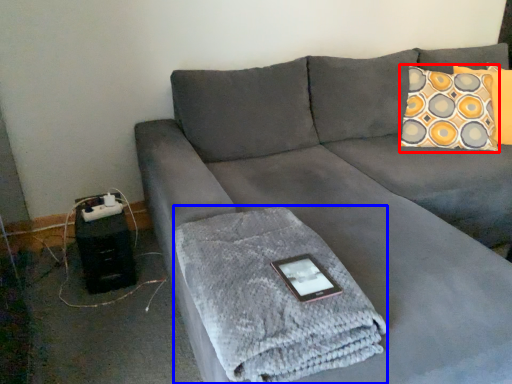
Question: Which object appears farthest to the camera in this image, throw pillow (highlighted by a red box) or bath towel (highlighted by a blue box)?

Choices:
 (A) throw pillow
 (B) bath towel

Answer: (A)